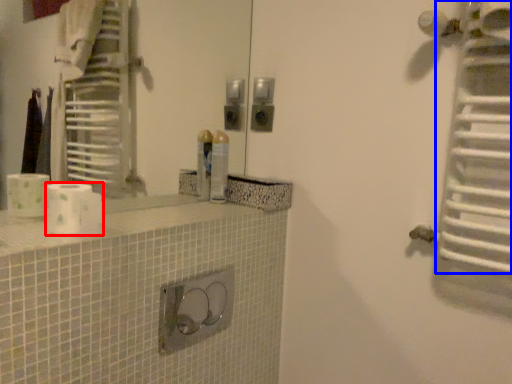
Question: Which point is closer to the camera, toilet paper (highlighted by a red box) or radiator (highlighted by a blue box)?

Choices:
 (A) toilet paper
 (B) radiator

Answer: (B)